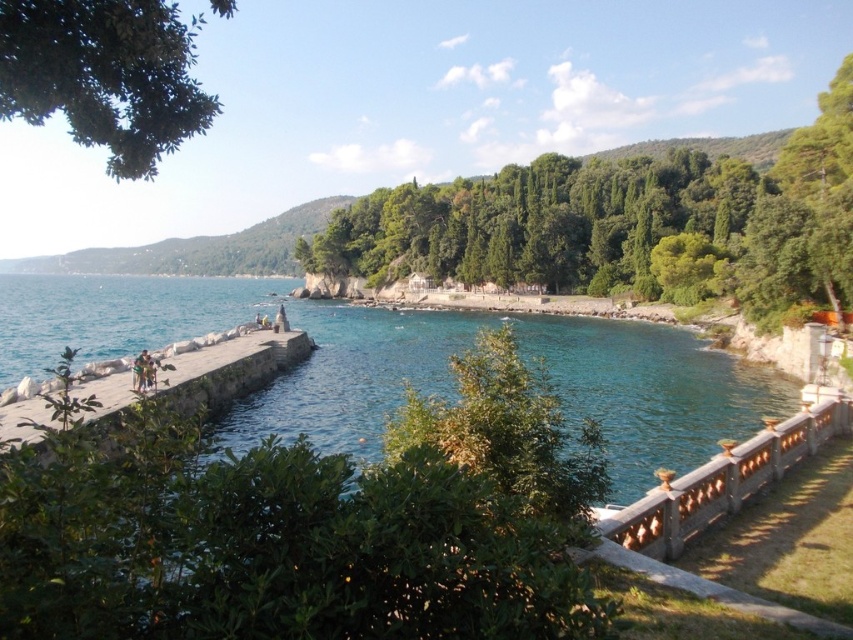
Is green leafy tree at center thinner than green leafy tree at upper left?

Yes, green leafy tree at center is thinner than green leafy tree at upper left.

Who is positioned more to the right, green leafy tree at center or green leafy tree at upper left?

green leafy tree at center is more to the right.

Is point (708, 275) behind point (112, 64)?

Yes, point (708, 275) is farther from viewer.

I want to click on green leafy tree at center, so click(624, 225).

Who is more distant from viewer, (80, 49) or (135, 365)?

The point (135, 365) is behind.

Is green leafy tree at upper left positioned behind light brown wooden bench at lower left?

No, green leafy tree at upper left is in front of light brown wooden bench at lower left.

Between point (129, 65) and point (151, 368), which one is positioned behind?

Positioned behind is point (151, 368).

This screenshot has width=853, height=640. What are the coordinates of `green leafy tree at upper left` in the screenshot? It's located at (105, 76).

Can you confirm if green leafy tree at center is wider than light brown wooden bench at lower left?

Yes, green leafy tree at center is wider than light brown wooden bench at lower left.

Between point (715, 218) and point (138, 371), which one is positioned in front?

Point (138, 371) is more forward.

Between point (802, 244) and point (148, 372), which one is positioned behind?

The point (802, 244) is more distant.

This screenshot has width=853, height=640. In order to click on green leafy tree at center in this screenshot , I will do `click(624, 225)`.